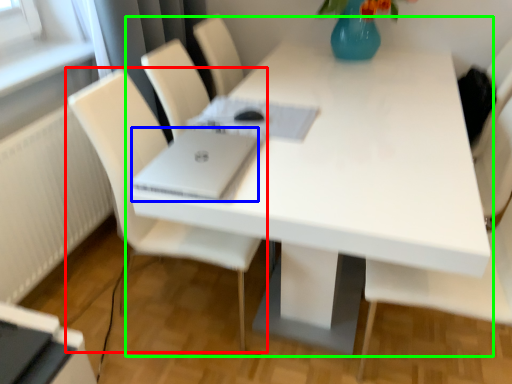
Question: Which object is the farthest from chair (highlighted by a red box)? Choose among these: laptop (highlighted by a blue box) or table (highlighted by a green box).

Choices:
 (A) laptop
 (B) table

Answer: (B)